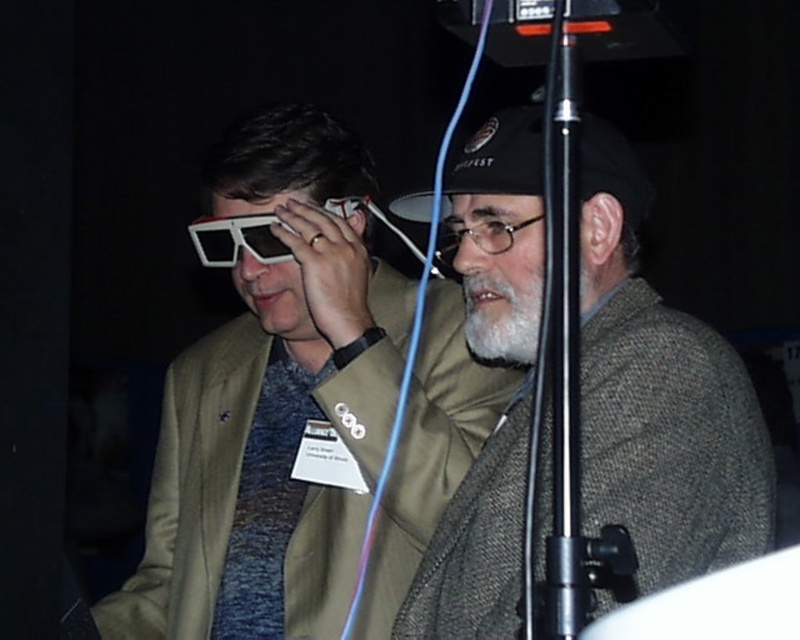
Can you confirm if white plastic goggles at center is smaller than clear plastic glasses at center?

Actually, white plastic goggles at center might be larger than clear plastic glasses at center.

Is white plastic goggles at center wider than clear plastic glasses at center?

Yes.

The width and height of the screenshot is (800, 640). In order to click on white plastic goggles at center in this screenshot , I will do `click(238, 240)`.

Which is in front, point (442, 241) or point (406, 244)?

Point (442, 241)

Who is lower down, clear plastic glasses at center or black matte microphone at center?

clear plastic glasses at center

Image resolution: width=800 pixels, height=640 pixels. Find the location of `clear plastic glasses at center`. clear plastic glasses at center is located at coordinates (478, 236).

The height and width of the screenshot is (640, 800). I want to click on clear plastic glasses at center, so click(478, 236).

Is matte white plastic glasses at center above gray woolen sweater at center?

No, matte white plastic glasses at center is not above gray woolen sweater at center.

Is matte white plastic glasses at center wider than gray woolen sweater at center?

Correct, the width of matte white plastic glasses at center exceeds that of gray woolen sweater at center.

The width and height of the screenshot is (800, 640). I want to click on matte white plastic glasses at center, so click(272, 404).

Identify the location of matte white plastic glasses at center. This screenshot has height=640, width=800. (272, 404).